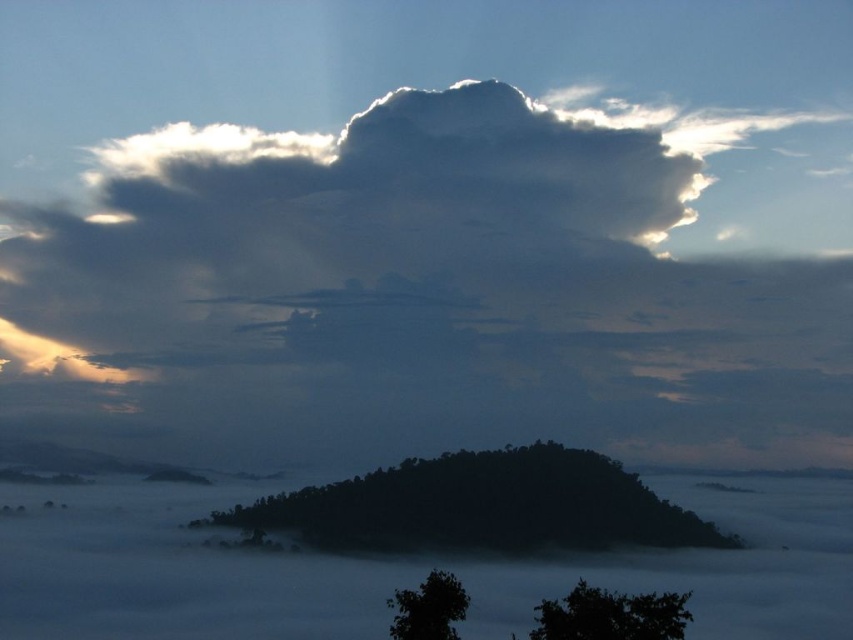
You are an astronomer analyzing this landscape image. You notice two points marked at coordinates point (653, 595) and point (426, 580). Based on the scene, which point is closer to the dark cloud formation?

Point (426, 580) is closer to the dark cloud formation because it is in front of point (653, 595), which is behind it.

You are a hiker standing at the base of the black matte tree at center and want to reach the dark green leafy tree at lower right. Which direction should you walk to get there?

The dark green leafy tree at lower right is to the right of the black matte tree at center, so you should walk towards the right to reach it.